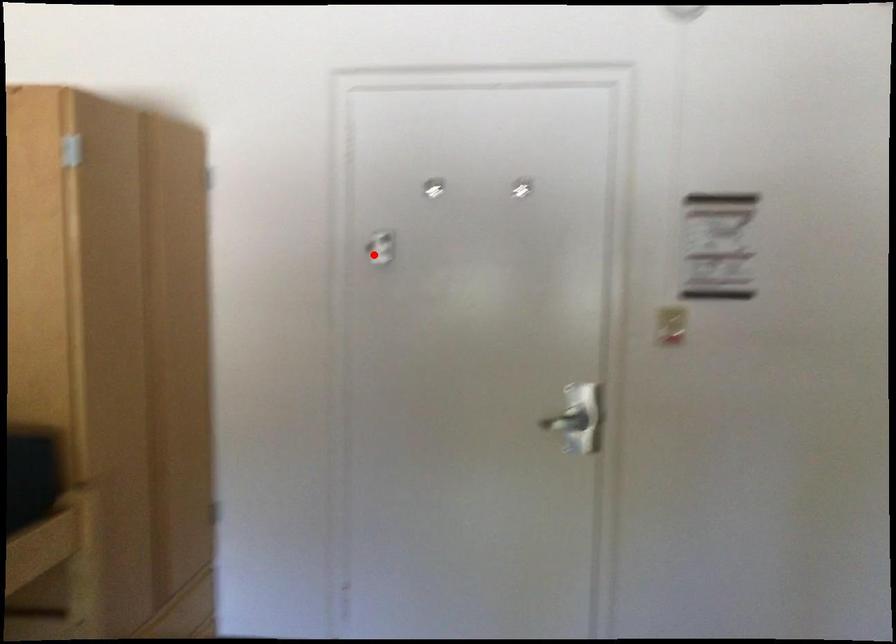
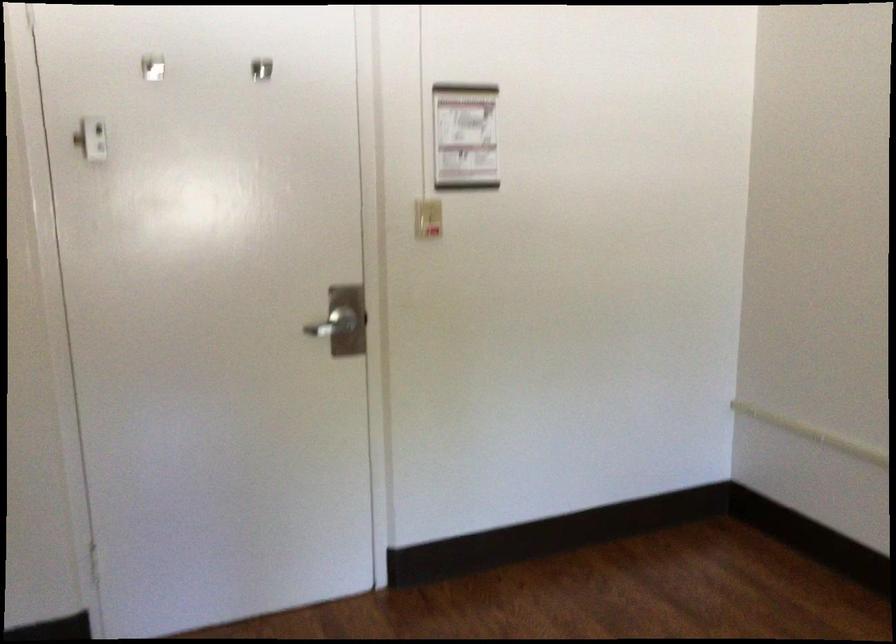
Question: I am providing you with two images of the same scene from different viewpoints. In image1, a red point is highlighted. Considering the same 3D point in image2, which of the following is correct?

Choices:
 (A) It is closer
 (B) It is farther

Answer: (A)